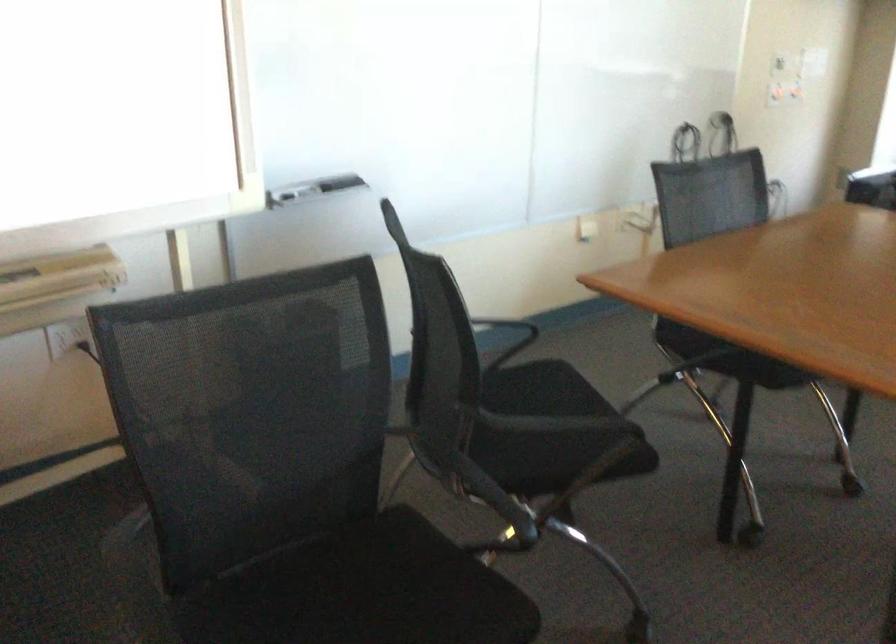
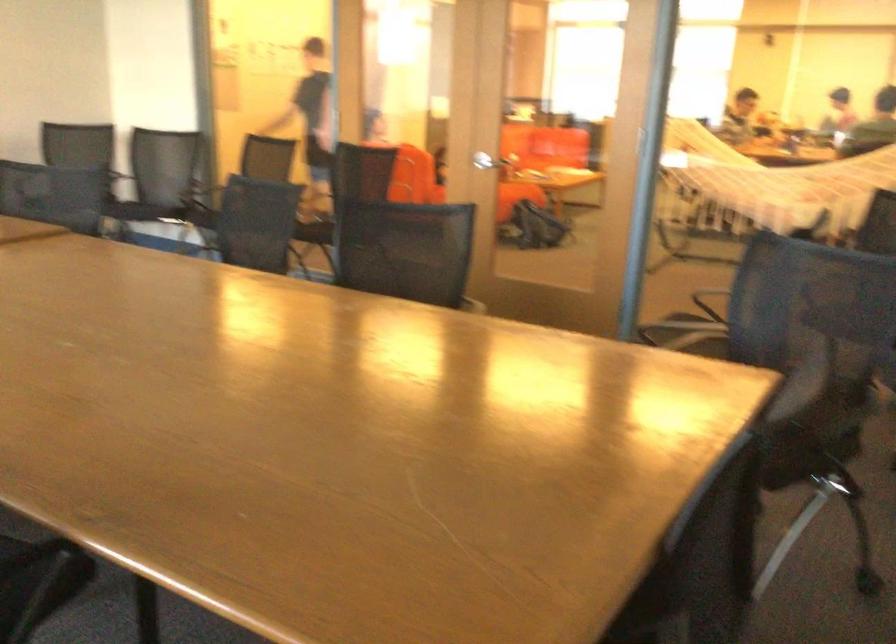
Question: I am providing you with two images of the same scene from different viewpoints. Which of the following objects are not visible in image2?

Choices:
 (A) black chair sitting surface
 (B) air fryer handle
 (C) white net hammock
 (D) sofa sitting surface

Answer: (A)